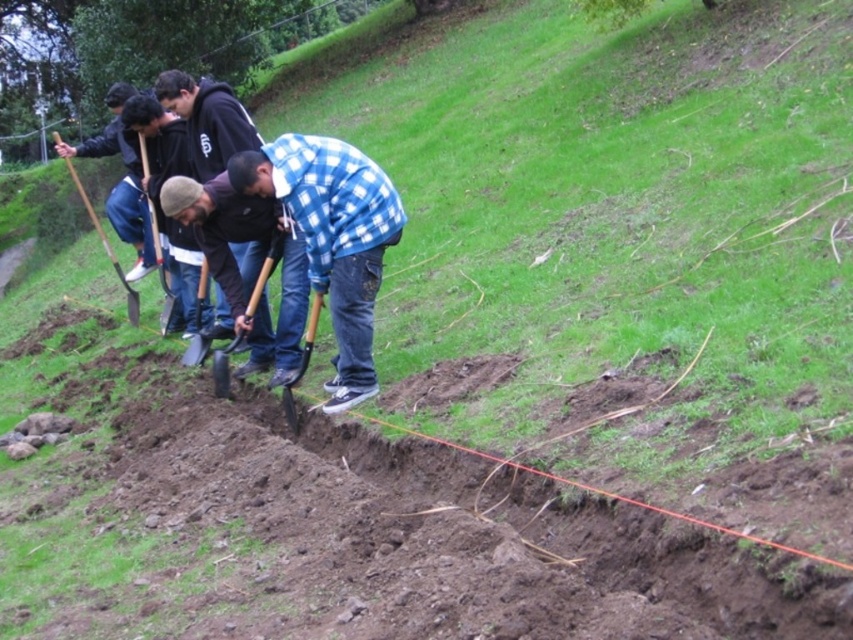
Is shiny metallic shovel at center positioned in front of wooden shovel at left?

Yes, it is in front of wooden shovel at left.

Which is below, shiny metallic shovel at center or wooden shovel at left?

Positioned lower is shiny metallic shovel at center.

Locate an element on the screen. The width and height of the screenshot is (853, 640). shiny metallic shovel at center is located at coordinates pyautogui.click(x=300, y=364).

Can you confirm if blue checkered shirt at center is positioned to the left of wooden shovel at center?

In fact, blue checkered shirt at center is to the right of wooden shovel at center.

Which is behind, point (363, 317) or point (265, 262)?

The point (265, 262) is behind.

At what (x,y) coordinates should I click in order to perform the action: click on blue checkered shirt at center. Please return your answer as a coordinate pair (x, y). This screenshot has width=853, height=640. Looking at the image, I should click on (332, 237).

At what (x,y) coordinates should I click in order to perform the action: click on blue checkered shirt at center. Please return your answer as a coordinate pair (x, y). This screenshot has width=853, height=640. Looking at the image, I should click on (332, 237).

Does wooden shovel at center appear on the right side of wooden shovel at left?

Yes, wooden shovel at center is to the right of wooden shovel at left.

In the scene shown: Between wooden shovel at center and wooden shovel at left, which one appears on the left side from the viewer's perspective?

wooden shovel at left

Between point (281, 243) and point (132, 324), which one is positioned in front?

Point (281, 243)

The height and width of the screenshot is (640, 853). I want to click on wooden shovel at center, so click(265, 272).